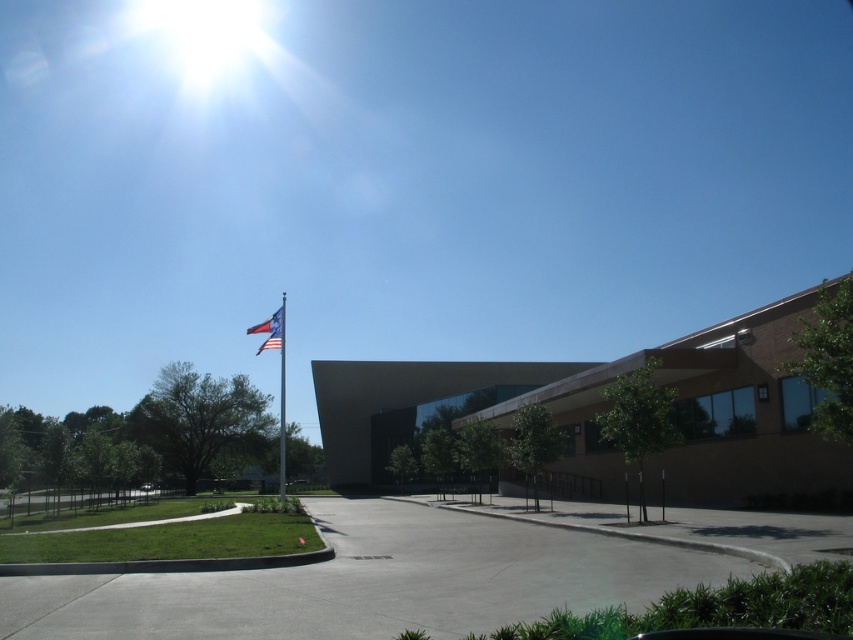
Can you confirm if polished metal flag pole at center is taller than american flag at upper left?

Correct, polished metal flag pole at center is much taller as american flag at upper left.

Does polished metal flag pole at center have a larger size compared to american flag at upper left?

Correct, polished metal flag pole at center is larger in size than american flag at upper left.

Locate an element on the screen. This screenshot has height=640, width=853. polished metal flag pole at center is located at coordinates (282, 403).

The image size is (853, 640). Identify the location of polished metal flag pole at center. (282, 403).